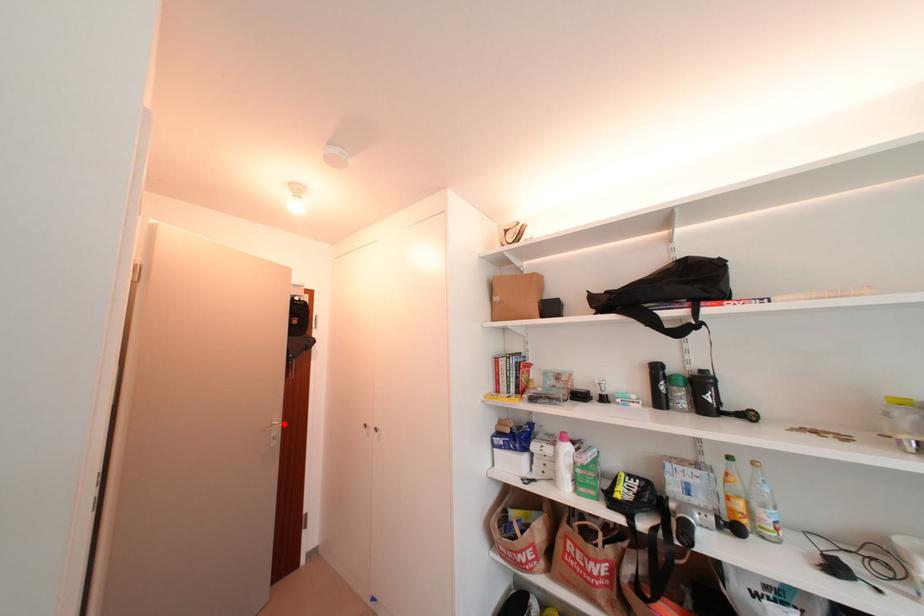
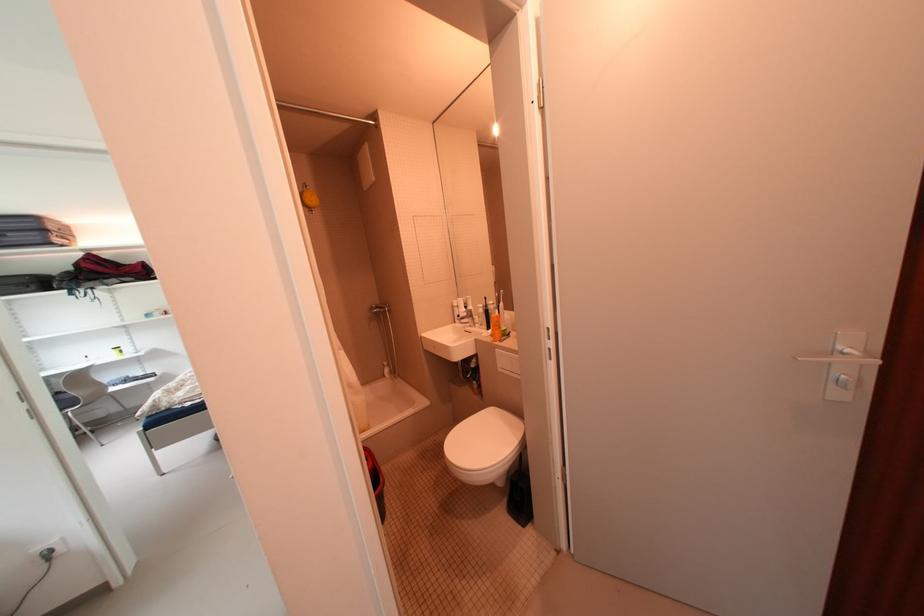
Find the pixel in the second image that matches the highlighted location in the first image.

(857, 352)